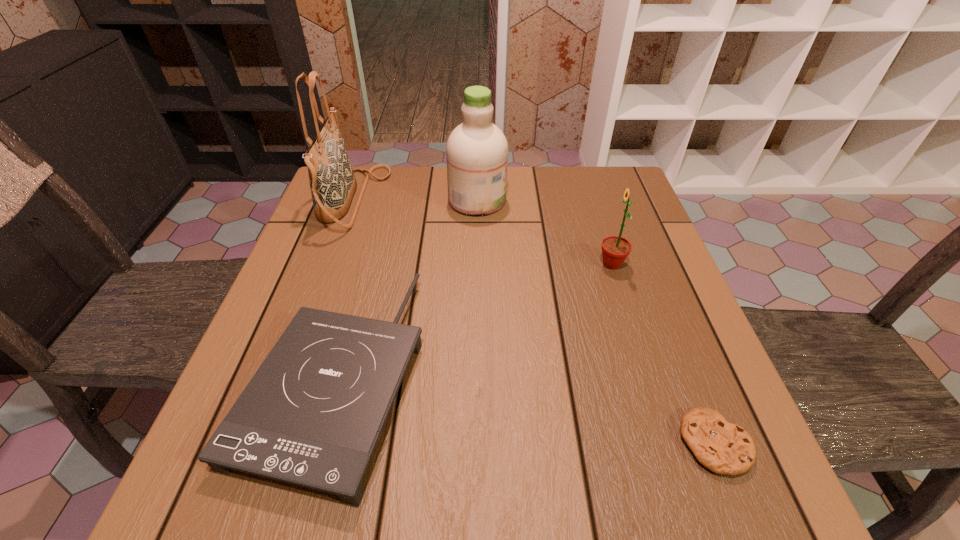
The image size is (960, 540). I want to click on the second closest object to the shortest object, so [x=312, y=414].

The image size is (960, 540). What are the coordinates of `free spot that satisfies the following two spatial constraints: 1. on the front-facing side of the shortest object; 2. on the right side of the handbag` in the screenshot? It's located at (264, 443).

Where is `free space in the image that satisfies the following two spatial constraints: 1. on the front-facing side of the handbag; 2. on the right side of the cookie`? The image size is (960, 540). free space in the image that satisfies the following two spatial constraints: 1. on the front-facing side of the handbag; 2. on the right side of the cookie is located at coordinates (264, 443).

Where is `vacant space that satisfies the following two spatial constraints: 1. on the face of the shortest object; 2. on the left side of the third shortest object`? The image size is (960, 540). vacant space that satisfies the following two spatial constraints: 1. on the face of the shortest object; 2. on the left side of the third shortest object is located at coordinates (669, 443).

Identify the location of vacant space that satisfies the following two spatial constraints: 1. on the face of the sunflower; 2. on the left side of the shortest object. (669, 443).

What are the coordinates of `free space that satisfies the following two spatial constraints: 1. on the front-facing side of the shortest object; 2. on the left side of the handbag` in the screenshot? It's located at (264, 443).

I want to click on vacant space that satisfies the following two spatial constraints: 1. on the front-facing side of the handbag; 2. on the left side of the hotplate, so click(x=289, y=375).